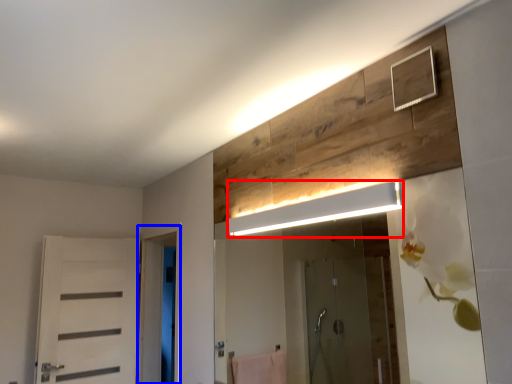
Question: Which object appears farthest to the camera in this image, light fixture (highlighted by a red box) or screen door (highlighted by a blue box)?

Choices:
 (A) light fixture
 (B) screen door

Answer: (B)